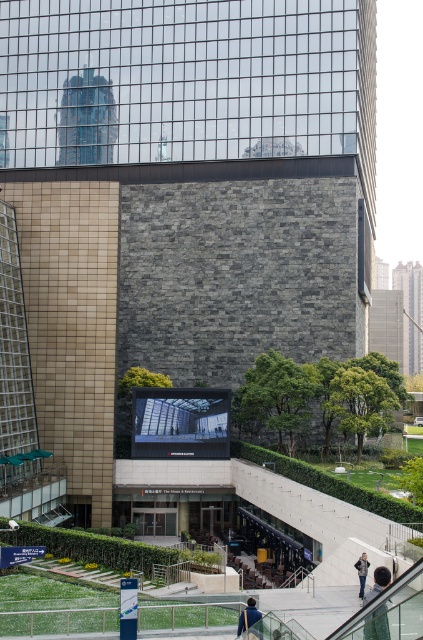
You are a photographer standing in front of the building and see a person with dark brown hair at lower right and a denim jacket at lower center. Which object is more to the right?

The denim jacket at lower center is more to the right because the dark brown hair at lower right is positioned on the left side of it.

You are a delivery person trying to leave a package at the building. You see a blue fabric jacket at lower center and a denim jacket at lower center. Which jacket is nearer to you?

The blue fabric jacket at lower center is closer to the viewer than the denim jacket at lower center, so the blue fabric jacket at lower center is nearer to you.

You are standing in front of the modern urban building and want to take a photo. There are two points marked on the building facade. Which point, point (241, 620) or point (359, 572), is closer to you when you are facing the building?

Point (241, 620) is closer to the camera than point (359, 572), so it is closer to you when facing the building.